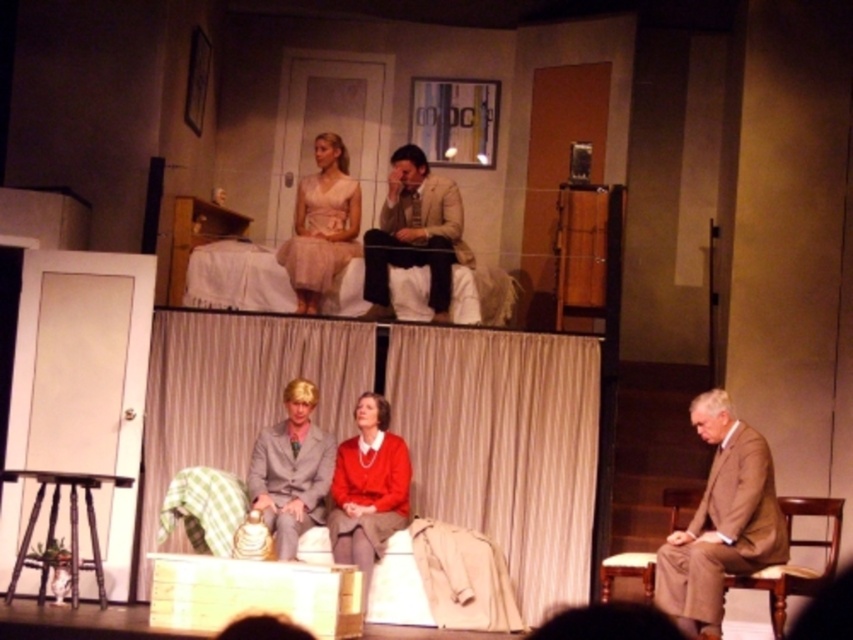
In the scene shown: You are a stagehand who needs to place a new prop that is 10 cm thick between the tan wool suit at lower right and the wooden stool at lower left. Can you fit the prop between them?

The tan wool suit at lower right is thinner than the wooden stool at lower left. Since the prop is 10 cm thick, you need to check the space between them. However, the description only states the thickness of the objects, not the distance between them. Without knowing the available space, it is impossible to determine if the prop will fit.

You are a stagehand who needs to move a 1.2 meter wide curtain rod from the tan wool suit at lower right to the wooden stool at lower left. Is there enough space between them to move the rod without bending it?

The tan wool suit at lower right and wooden stool at lower left are 7.77 meters apart from each other. Since the rod is 1.2 meters wide, there is more than enough space to move it straight without bending.

You are standing at the center of the stage. There is a point marked at coordinates (x=721, y=522). What object is located at that point?

The point at coordinates (x=721, y=522) corresponds to the tan wool suit at lower right.